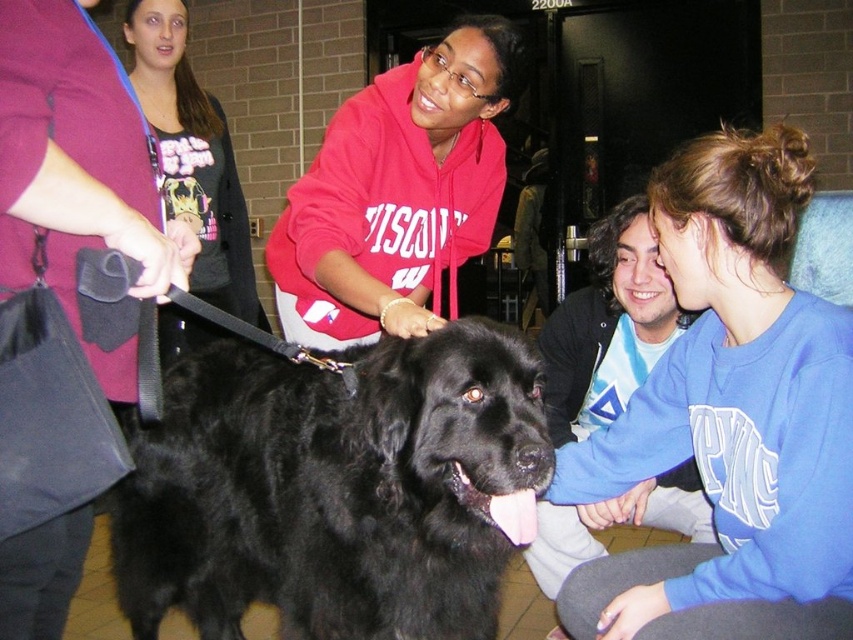
In the scene shown: You are standing in the room and want to pick up the matte black leash at left to walk the dog. However, there is a blue sweatshirt at lower right in the way. Can you reach the leash without moving the sweatshirt?

The blue sweatshirt at lower right is positioned under the matte black leash at left, so you can reach the leash without moving the sweatshirt because it is above the sweatshirt.

You are organizing a photo shoot and need to ensure that the blue sweatshirt at lower right and the matte black dog at center are both visible in the frame. Given that the camera can only capture objects up to a certain width, which object might require adjusting the camera angle to accommodate its size?

The blue sweatshirt at lower right has a larger width than the matte black dog at center, so it might require adjusting the camera angle to accommodate its size.